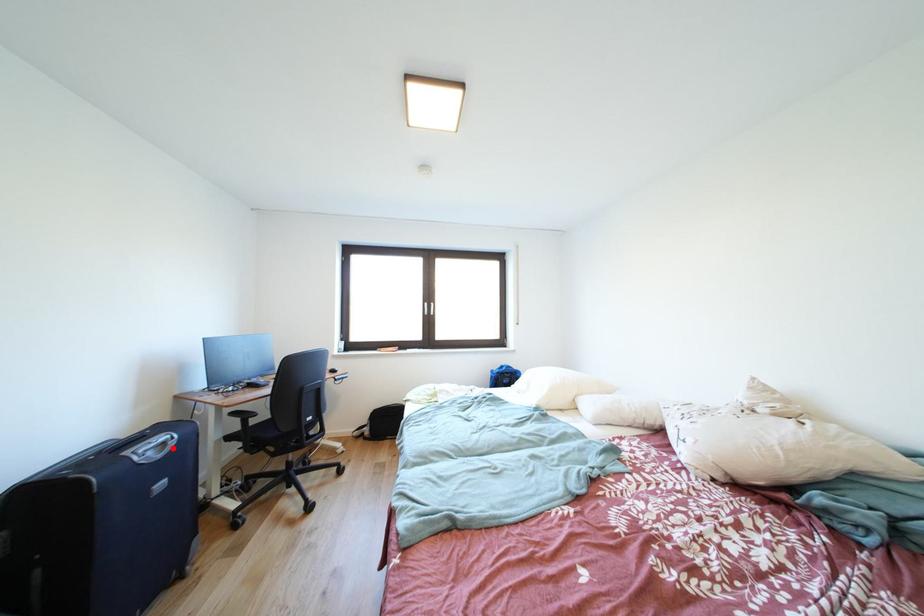
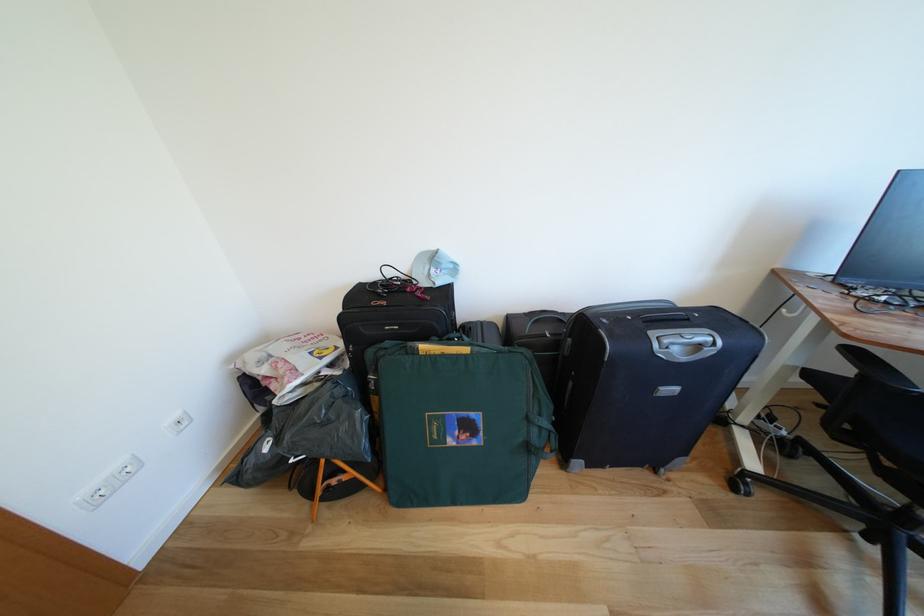
In the second image, find the point that corresponds to the highlighted location in the first image.

(707, 351)